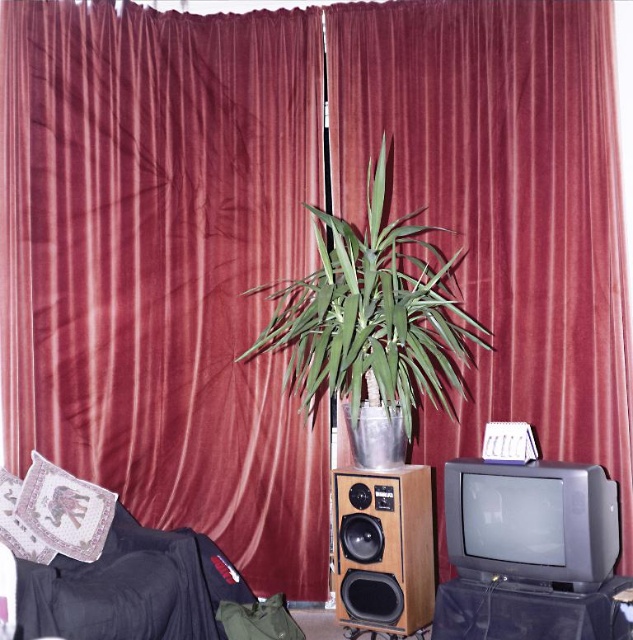
Question: Does green leafy plant at center have a smaller size compared to embroidered fabric pillow at lower left?

Choices:
 (A) yes
 (B) no

Answer: (B)

Question: Observing the image, what is the correct spatial positioning of wooden speaker at center in reference to patterned fabric pillow at left?

Choices:
 (A) right
 (B) left

Answer: (A)

Question: Which object is farther from the camera taking this photo?

Choices:
 (A) wooden speaker at center
 (B) green leafy plant at center

Answer: (A)

Question: Is green leafy plant at center to the right of patterned fabric pillow at left from the viewer's perspective?

Choices:
 (A) yes
 (B) no

Answer: (A)

Question: Which of the following is the closest to the observer?

Choices:
 (A) (15, 476)
 (B) (410, 416)
 (C) (346, 634)

Answer: (A)

Question: Which object is positioned farthest from the green leafy plant at center?

Choices:
 (A) patterned fabric pillow at left
 (B) embroidered fabric pillow at lower left
 (C) wooden speaker at center

Answer: (A)